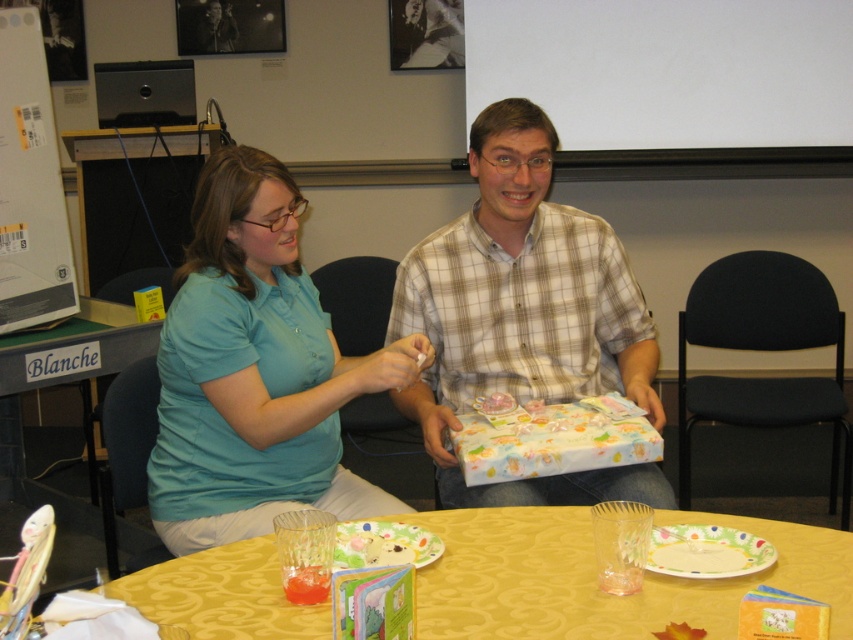
Question: Can you confirm if plaid shirt at center is wider than yellow fabric table at lower center?

Choices:
 (A) yes
 (B) no

Answer: (A)

Question: Which is nearer to the yellow fabric table at lower center?

Choices:
 (A) matte blue shirt at left
 (B) yellow fabric table at center
 (C) teal shirt at left
 (D) plaid shirt at center

Answer: (C)

Question: Which of the following is the closest to the observer?

Choices:
 (A) (601, 477)
 (B) (102, 538)
 (C) (283, 472)
 (D) (467, 288)

Answer: (C)

Question: Is plaid shirt at center to the right of yellow fabric table at center from the viewer's perspective?

Choices:
 (A) no
 (B) yes

Answer: (B)

Question: Which object is positioned closest to the yellow fabric table at lower center?

Choices:
 (A) plaid shirt at center
 (B) matte blue shirt at left
 (C) yellow fabric table at center
 (D) teal shirt at left

Answer: (D)

Question: Considering the relative positions of plaid shirt at center and yellow fabric table at center in the image provided, where is plaid shirt at center located with respect to yellow fabric table at center?

Choices:
 (A) right
 (B) left

Answer: (A)